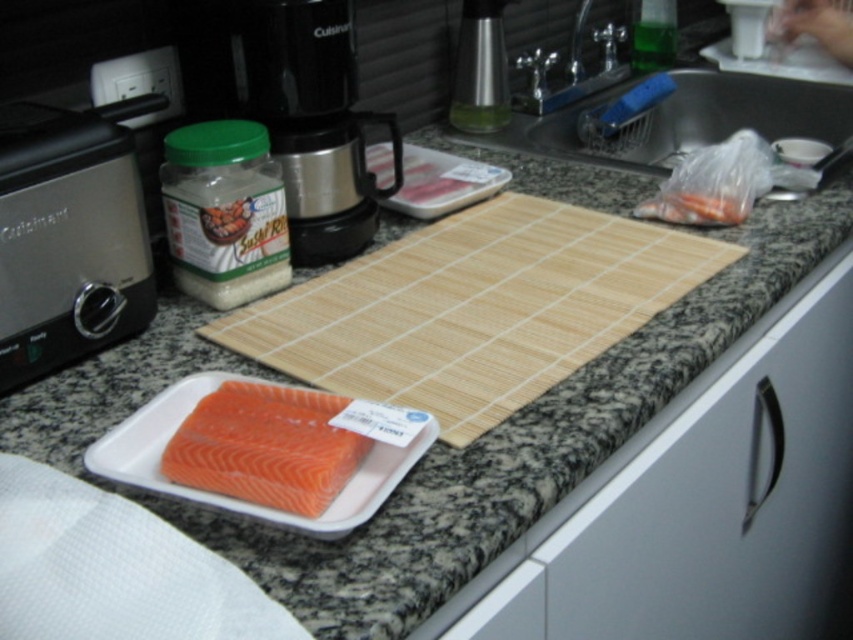
Looking at this image, you are organizing the kitchen and need to place both the white matte drawer at lower right and the satin silver toaster at left. Since you want to prioritize using the larger storage space for bigger items, which object should you place in the larger storage area?

The white matte drawer at lower right is larger in size than the satin silver toaster at left, so you should place the larger items in the white matte drawer at lower right.

You are standing in the kitchen and want to make coffee. Where is the black plastic coffee machine at upper center located?

The black plastic coffee machine at upper center is located at point (312,120).